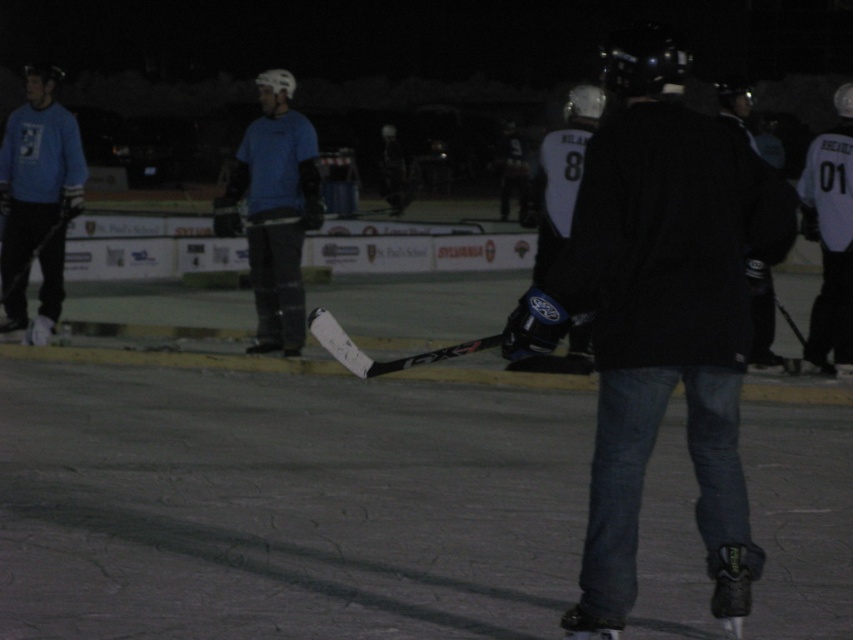
You are a spectator at the ice hockey game and want to locate the blue matte hockey stick at center. According to the coordinates provided, where would you look on the image to find it?

The blue matte hockey stick at center is located at the coordinates point (276, 209) in the image.

You are a spectator at the ice hockey game and want to take a photo of both the point at (57,252) and the point at (809,150). Which point will appear closer to you in the photo?

The point at (57,252) will appear closer to you in the photo because it is further to the viewer than the point at (809,150).

You are an ice hockey coach analyzing the game. You notice two items in the scene, the blue matte hockey stick at center and the matte blue sweater at left. Which item takes up more area in the image?

The matte blue sweater at left takes up more area in the image than the blue matte hockey stick at center because the blue matte hockey stick at center occupies less space than matte blue sweater at left.